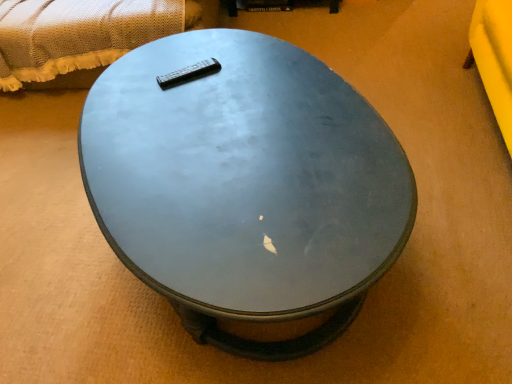
Find the location of a particular element. The width and height of the screenshot is (512, 384). free point above matte black table at center (from a real-world perspective) is located at coordinates (237, 127).